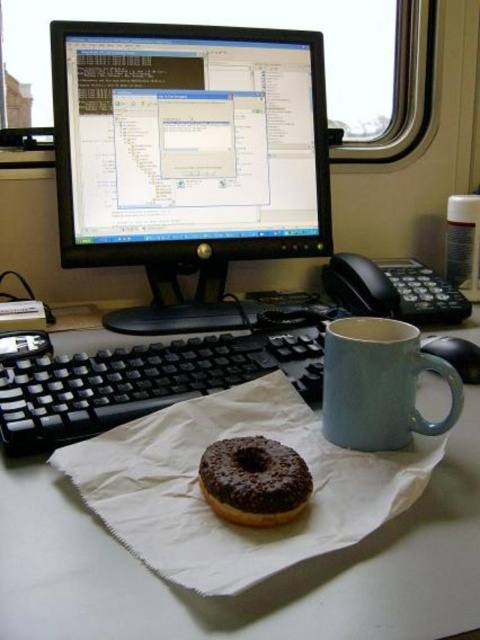
From the picture: Is black glossy monitor at upper center below chocolate-coated donut at center?

No.

From the picture: Is black glossy monitor at upper center in front of chocolate-coated donut at center?

That is False.

Describe the element at coordinates (189, 141) in the screenshot. I see `black glossy monitor at upper center` at that location.

Find the location of a particular element. Image resolution: width=480 pixels, height=640 pixels. black glossy monitor at upper center is located at coordinates (189, 141).

Can you confirm if black glossy monitor at upper center is taller than black plastic phone at right?

Yes.

Between black glossy monitor at upper center and black plastic phone at right, which one appears on the left side from the viewer's perspective?

From the viewer's perspective, black glossy monitor at upper center appears more on the left side.

Is point (203, 116) farther from viewer compared to point (399, 292)?

That is False.

You are a GUI agent. You are given a task and a screenshot of the screen. Output one action in this format:
    pyautogui.click(x=<x>, y=<y>)
    Task: Click on the black glossy monitor at upper center
    The image size is (480, 640).
    Given the screenshot: What is the action you would take?
    pyautogui.click(x=189, y=141)

Does white paper at center have a greater height compared to matte blue mug at right?

In fact, white paper at center may be shorter than matte blue mug at right.

In order to click on white paper at center in this screenshot , I will do `click(251, 588)`.

Locate an element on the screen. white paper at center is located at coordinates (251, 588).